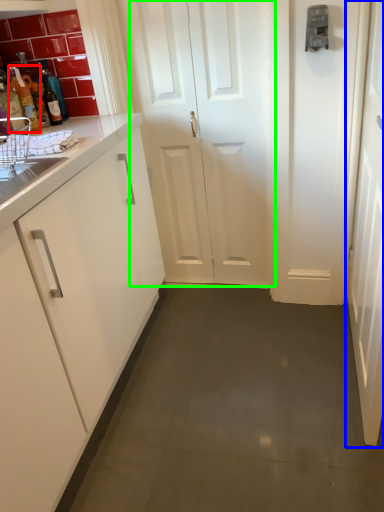
Question: Based on their relative distances, which object is farther from bottle (highlighted by a red box)? Choose from door (highlighted by a blue box) and door (highlighted by a green box).

Choices:
 (A) door
 (B) door

Answer: (A)